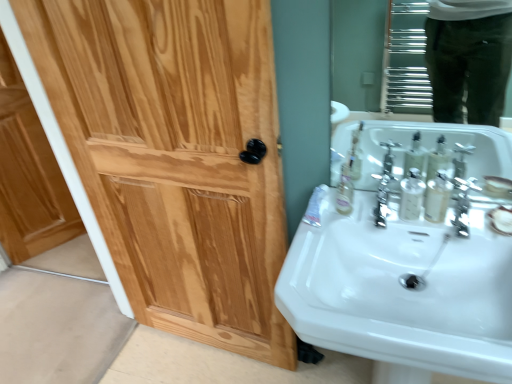
Question: From the image's perspective, is light brown wood door at left positioned above or below white glossy sink at lower right?

Choices:
 (A) below
 (B) above

Answer: (B)

Question: From a real-world perspective, is light brown wood door at left physically located above or below white glossy sink at lower right?

Choices:
 (A) below
 (B) above

Answer: (A)

Question: Based on their relative distances, which object is nearer to the light brown wood door at left?

Choices:
 (A) glossy chrome mirror at upper right
 (B) satin nickel faucet at right
 (C) translucent plastic mouthwash at sink right, which ranks as the 2th mouthwash in left-to-right order
 (D) clear plastic mouthwash at right, which is the 1th mouthwash in left-to-right order
 (E) polished chrome faucet at center

Answer: (E)

Question: Estimate the real-world distances between objects in this image. Which object is farther from the polished chrome faucet at center?

Choices:
 (A) glossy chrome mirror at upper right
 (B) clear plastic mouthwash at right, the second mouthwash from the right
 (C) translucent plastic mouthwash at sink right, the first mouthwash positioned from the right
 (D) white glossy tube at lower right
 (E) light brown wood door at left

Answer: (A)